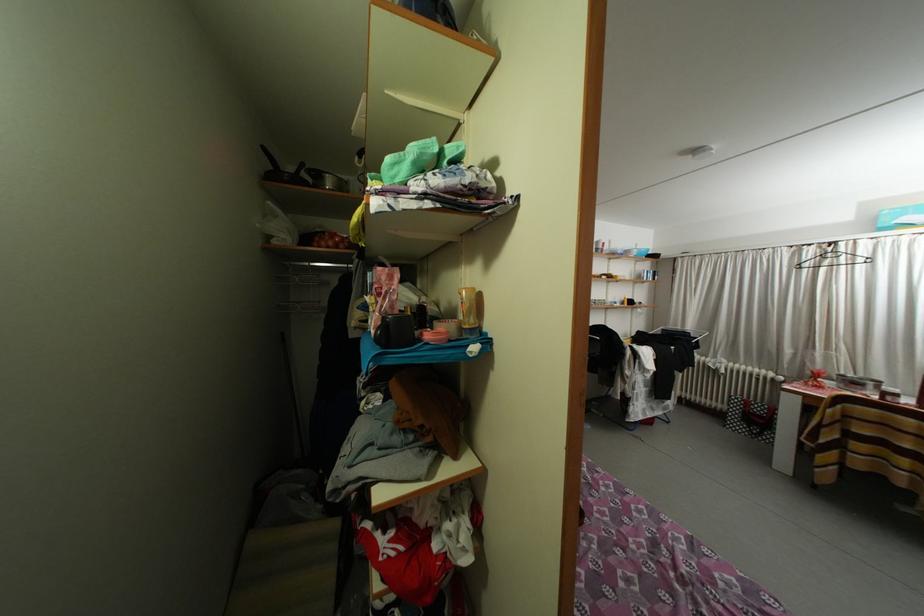
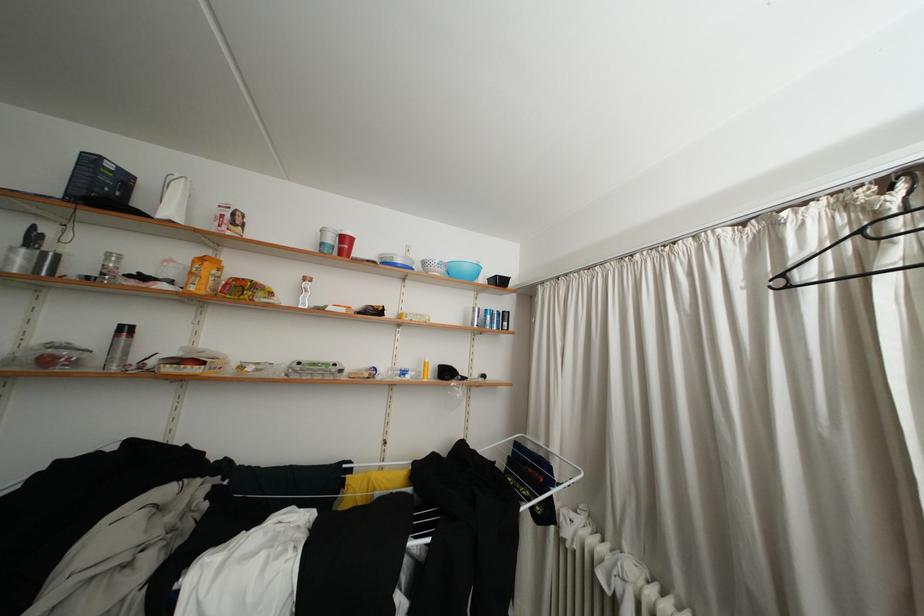
The point at (604, 254) is marked in the first image. Where is the corresponding point in the second image?

(330, 249)